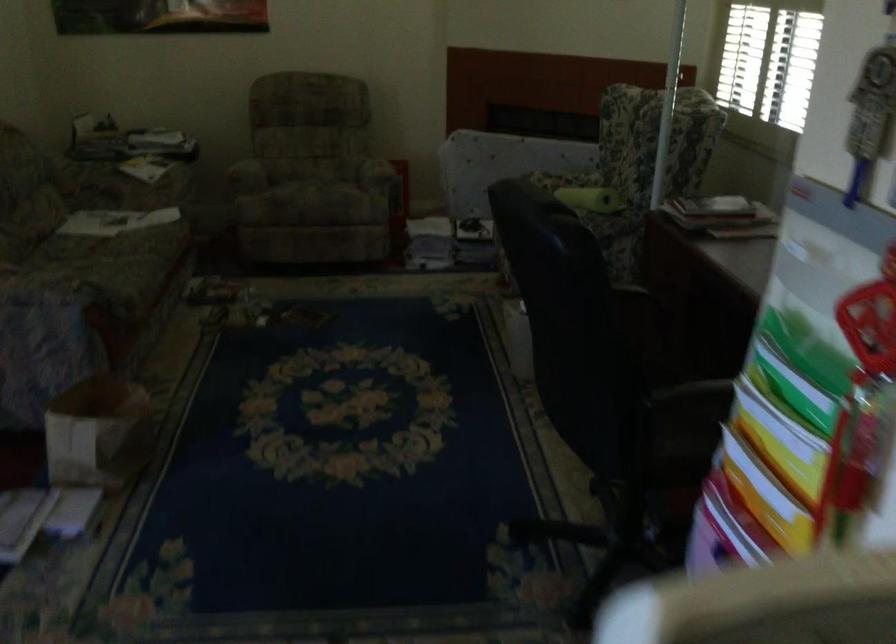
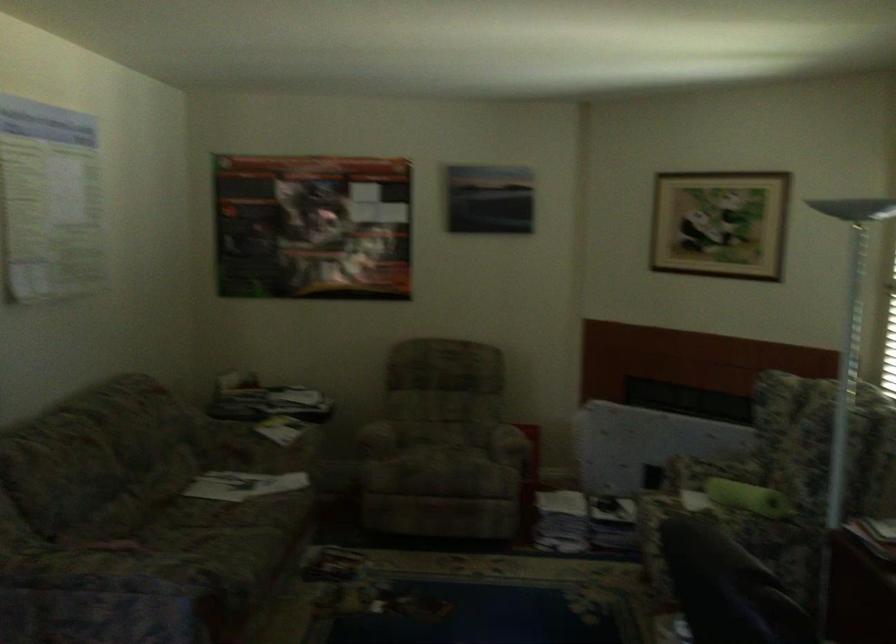
Question: How did the camera likely rotate?

Choices:
 (A) Left
 (B) Right
 (C) Up
 (D) Down

Answer: (C)